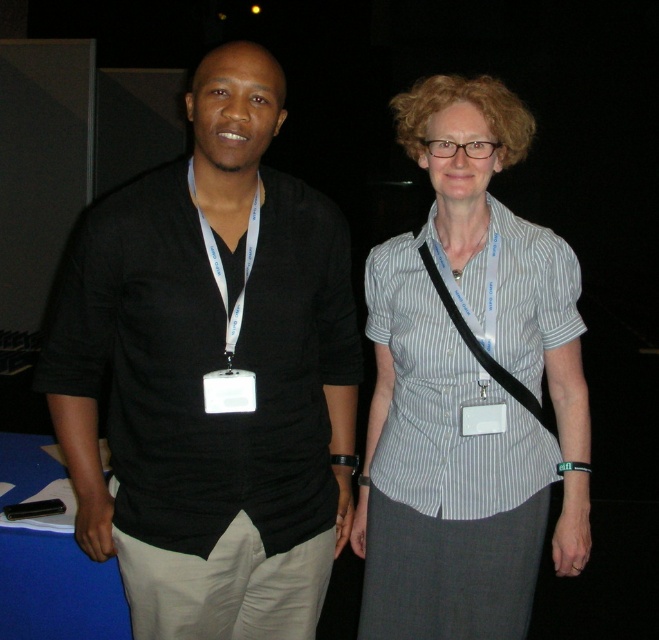
Looking at this image, you are standing in front of a large screen that displays the image. The screen has a coordinate system where the bottom left corner is the origin point. The x and y axes increase to the right and up respectively. You need to locate the black cotton shirt at left on the screen. What are its coordinates?

The coordinates of the black cotton shirt at left are at point (x=210, y=369).

Looking at this image, you are a photographer at an event and need to adjust the camera focus to capture both the black cotton shirt at left and the white striped shirt at center. The camera has a depth of field that can cover 12 inches. Will both shirts be in focus?

The black cotton shirt at left and the white striped shirt at center are 13.13 inches apart from each other. Since the distance between them exceeds the camera depth of field of 12 inches, the photographer will need to adjust the focus to ensure both are in focus.